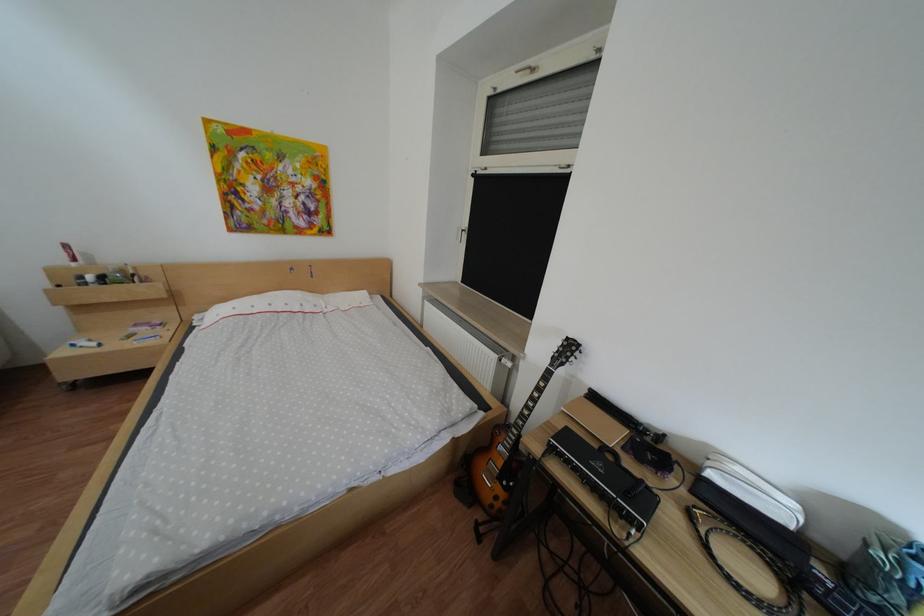
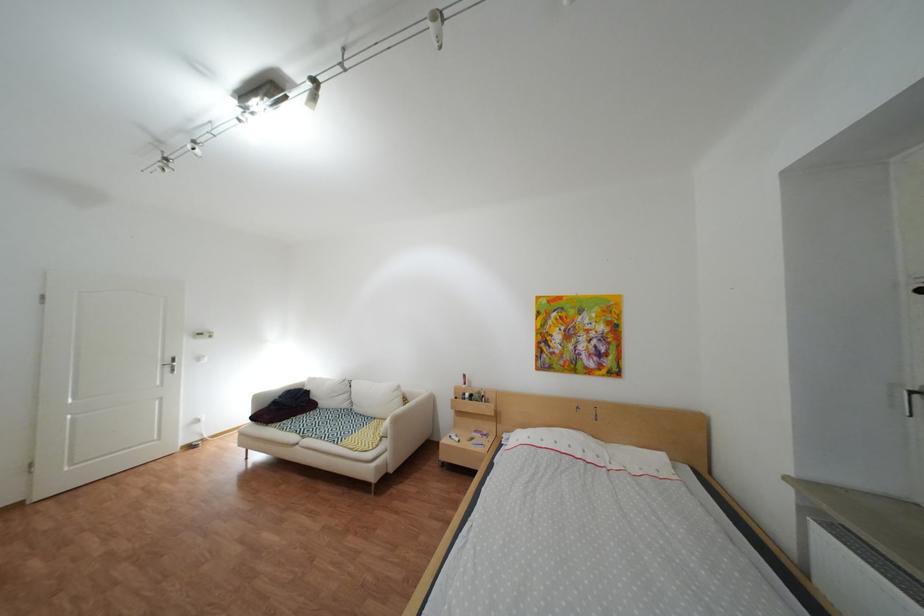
Where in the second image is the point corresponding to (x=99, y=344) from the first image?

(469, 438)